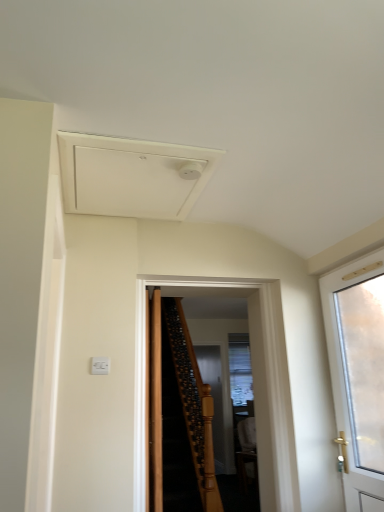
Measure the distance between white frosted glass door at right, which appears as the 1th door when viewed from the right, and camera.

They are 1.99 meters apart.

This screenshot has height=512, width=384. Find the location of `white matte exhaust hood at upper center`. white matte exhaust hood at upper center is located at coordinates (132, 176).

Image resolution: width=384 pixels, height=512 pixels. Describe the element at coordinates (255, 385) in the screenshot. I see `brown wooden door at center, which is counted as the 2th door, starting from the left` at that location.

You are a GUI agent. You are given a task and a screenshot of the screen. Output one action in this format:
    pyautogui.click(x=<x>, y=<y>)
    Task: Click on the brown wooden door at center, arranged as the third door when viewed from the right
    The width and height of the screenshot is (384, 512).
    Given the screenshot: What is the action you would take?
    pyautogui.click(x=155, y=403)

Measure the distance between point (151,422) and camera.

Point (151,422) is 4.03 meters away from camera.

Where is `white frosted glass door at right, which ranks as the third door in left-to-right order`? The image size is (384, 512). white frosted glass door at right, which ranks as the third door in left-to-right order is located at coordinates (358, 372).

Is clear glass screen door at center not within brown wooden door at center, arranged as the third door when viewed from the right?

clear glass screen door at center lies outside brown wooden door at center, arranged as the third door when viewed from the right,'s area.

Is clear glass screen door at center shorter than brown wooden door at center, arranged as the third door when viewed from the right?

No.

Which is more to the right, clear glass screen door at center or brown wooden door at center, the first door when ordered from left to right?

From the viewer's perspective, clear glass screen door at center appears more on the right side.

In the scene shown: From the image's perspective, which is below, white frosted glass door at right, which appears as the 1th door when viewed from the right, or white matte exhaust hood at upper center?

white frosted glass door at right, which appears as the 1th door when viewed from the right, is shown below in the image.

Which is behind, point (371, 433) or point (142, 167)?

The point (371, 433) is farther.

From a real-world perspective, is white frosted glass door at right, which appears as the 1th door when viewed from the right, on top of white matte exhaust hood at upper center?

No, from a real-world perspective, white frosted glass door at right, which appears as the 1th door when viewed from the right, is not on top of white matte exhaust hood at upper center.

Who is taller, white frosted glass door at right, which appears as the 1th door when viewed from the right, or white matte exhaust hood at upper center?

Standing taller between the two is white frosted glass door at right, which appears as the 1th door when viewed from the right.

Is clear glass screen door at center with white frosted glass door at right, which appears as the 1th door when viewed from the right?

No, clear glass screen door at center is not beside white frosted glass door at right, which appears as the 1th door when viewed from the right.

From a real-world perspective, does clear glass screen door at center sit lower than white frosted glass door at right, which ranks as the third door in left-to-right order?

Yes, from a real-world perspective, clear glass screen door at center is beneath white frosted glass door at right, which ranks as the third door in left-to-right order.

Is clear glass screen door at center located outside white frosted glass door at right, which appears as the 1th door when viewed from the right?

Yes, clear glass screen door at center is located beyond the bounds of white frosted glass door at right, which appears as the 1th door when viewed from the right.

Can you confirm if clear glass screen door at center is positioned to the left of white frosted glass door at right, which appears as the 1th door when viewed from the right?

Yes.

From the picture: From the image's perspective, is brown wooden door at center, which is the second door from right to left, below white matte exhaust hood at upper center?

Yes, from the image's perspective, brown wooden door at center, which is the second door from right to left, is below white matte exhaust hood at upper center.

Is brown wooden door at center, which is counted as the 2th door, starting from the left, shorter than white matte exhaust hood at upper center?

No.

From a real-world perspective, who is located lower, brown wooden door at center, which is the second door from right to left, or white matte exhaust hood at upper center?

brown wooden door at center, which is the second door from right to left, from a real-world perspective.

Is the surface of brown wooden door at center, which is the second door from right to left, in direct contact with white matte exhaust hood at upper center?

No, brown wooden door at center, which is the second door from right to left, is not in contact with white matte exhaust hood at upper center.

Image resolution: width=384 pixels, height=512 pixels. I want to click on exhaust hood that is above the brown wooden door at center, arranged as the third door when viewed from the right (from a real-world perspective), so click(132, 176).

From the picture: What's the angular difference between white matte exhaust hood at upper center and brown wooden door at center, arranged as the third door when viewed from the right,'s facing directions?

The facing directions of white matte exhaust hood at upper center and brown wooden door at center, arranged as the third door when viewed from the right, are 86.5 degrees apart.

Can you confirm if white matte exhaust hood at upper center is shorter than brown wooden door at center, arranged as the third door when viewed from the right?

Yes.

Is point (170, 189) in front of point (150, 401)?

Yes, it is in front of point (150, 401).

Is white frosted glass door at right, which appears as the 1th door when viewed from the right, positioned beyond the bounds of brown wooden door at center, the first door when ordered from left to right?

That's correct, white frosted glass door at right, which appears as the 1th door when viewed from the right, is outside of brown wooden door at center, the first door when ordered from left to right.

Between white frosted glass door at right, which ranks as the third door in left-to-right order, and brown wooden door at center, arranged as the third door when viewed from the right, which one appears on the left side from the viewer's perspective?

Positioned to the left is brown wooden door at center, arranged as the third door when viewed from the right.

From the image's perspective, is white frosted glass door at right, which ranks as the third door in left-to-right order, beneath brown wooden door at center, arranged as the third door when viewed from the right?

No, from the image's perspective, white frosted glass door at right, which ranks as the third door in left-to-right order, is not below brown wooden door at center, arranged as the third door when viewed from the right.

From a real-world perspective, is white frosted glass door at right, which appears as the 1th door when viewed from the right, located higher than brown wooden door at center, the first door when ordered from left to right?

Correct, in the physical world, white frosted glass door at right, which appears as the 1th door when viewed from the right, is higher than brown wooden door at center, the first door when ordered from left to right.

From a real-world perspective, does brown wooden door at center, the first door when ordered from left to right, sit lower than clear glass screen door at center?

No.

Which object is more forward, brown wooden door at center, the first door when ordered from left to right, or clear glass screen door at center?

brown wooden door at center, the first door when ordered from left to right, is more forward.

Is brown wooden door at center, the first door when ordered from left to right, aimed at clear glass screen door at center?

No.

Can we say brown wooden door at center, the first door when ordered from left to right, lies outside clear glass screen door at center?

Yes, brown wooden door at center, the first door when ordered from left to right, is not within clear glass screen door at center.

The height and width of the screenshot is (512, 384). What are the coordinates of `screen door behind the brown wooden door at center, the first door when ordered from left to right` in the screenshot? It's located at (214, 398).

This screenshot has width=384, height=512. I want to click on door in front of the white matte exhaust hood at upper center, so click(x=358, y=372).

When comparing their distances from brown wooden door at center, the first door when ordered from left to right, does brown wooden door at center, which is the second door from right to left, or white matte exhaust hood at upper center seem further?

white matte exhaust hood at upper center lies further to brown wooden door at center, the first door when ordered from left to right, than the other object.

Considering their positions, is white matte exhaust hood at upper center positioned closer to white frosted glass door at right, which appears as the 1th door when viewed from the right, than brown wooden door at center, which is counted as the 2th door, starting from the left?

brown wooden door at center, which is counted as the 2th door, starting from the left, is positioned closer to the anchor white frosted glass door at right, which appears as the 1th door when viewed from the right.

From the image, which object appears to be farther from brown wooden door at center, which is the second door from right to left, clear glass screen door at center or white matte exhaust hood at upper center?

Based on the image, clear glass screen door at center appears to be further to brown wooden door at center, which is the second door from right to left.

Based on their spatial positions, is brown wooden door at center, arranged as the third door when viewed from the right, or brown wooden door at center, which is the second door from right to left, further from clear glass screen door at center?

Based on the image, brown wooden door at center, which is the second door from right to left, appears to be further to clear glass screen door at center.

When comparing their distances from clear glass screen door at center, does brown wooden door at center, which is the second door from right to left, or white matte exhaust hood at upper center seem further?

Based on the image, white matte exhaust hood at upper center appears to be further to clear glass screen door at center.

Based on their spatial positions, is white frosted glass door at right, which ranks as the third door in left-to-right order, or white matte exhaust hood at upper center closer to brown wooden door at center, the first door when ordered from left to right?

Based on the image, white frosted glass door at right, which ranks as the third door in left-to-right order, appears to be nearer to brown wooden door at center, the first door when ordered from left to right.

From the picture: Looking at the image, which one is located further to clear glass screen door at center, white frosted glass door at right, which ranks as the third door in left-to-right order, or brown wooden door at center, the first door when ordered from left to right?

The object further to clear glass screen door at center is white frosted glass door at right, which ranks as the third door in left-to-right order.

From the image, which object appears to be nearer to white frosted glass door at right, which ranks as the third door in left-to-right order, clear glass screen door at center or brown wooden door at center, which is the second door from right to left?

Among the two, brown wooden door at center, which is the second door from right to left, is located nearer to white frosted glass door at right, which ranks as the third door in left-to-right order.

Where is `door between white matte exhaust hood at upper center and brown wooden door at center, which is counted as the 2th door, starting from the left, in the vertical direction`? The height and width of the screenshot is (512, 384). door between white matte exhaust hood at upper center and brown wooden door at center, which is counted as the 2th door, starting from the left, in the vertical direction is located at coordinates (358, 372).

Where is `door located between brown wooden door at center, the first door when ordered from left to right, and white frosted glass door at right, which appears as the 1th door when viewed from the right, in the left-right direction`? door located between brown wooden door at center, the first door when ordered from left to right, and white frosted glass door at right, which appears as the 1th door when viewed from the right, in the left-right direction is located at coordinates (255, 385).

What are the coordinates of `exhaust hood located between white frosted glass door at right, which ranks as the third door in left-to-right order, and clear glass screen door at center in the depth direction` in the screenshot? It's located at (132, 176).

The width and height of the screenshot is (384, 512). What are the coordinates of `door between brown wooden door at center, which is the second door from right to left, and clear glass screen door at center in the front-back direction` in the screenshot? It's located at (155, 403).